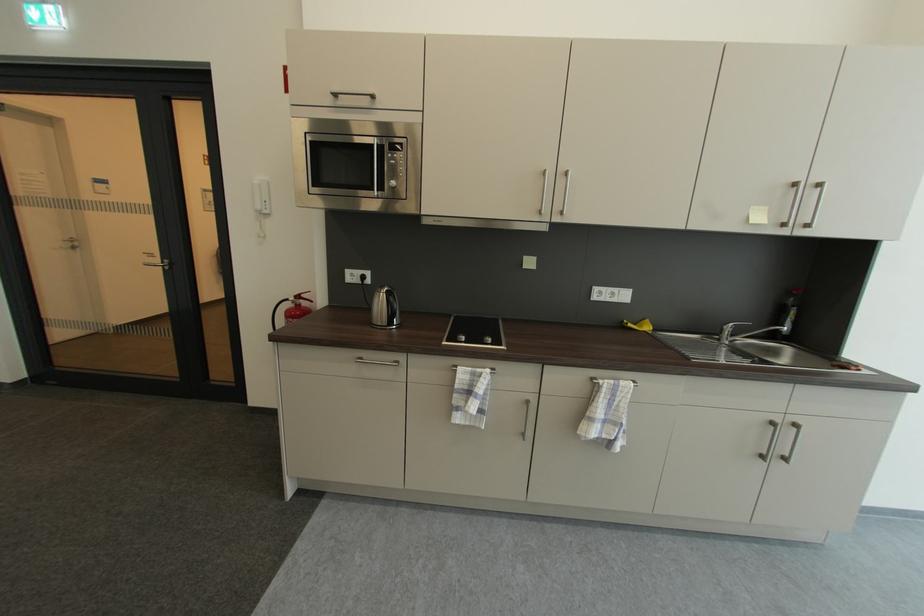
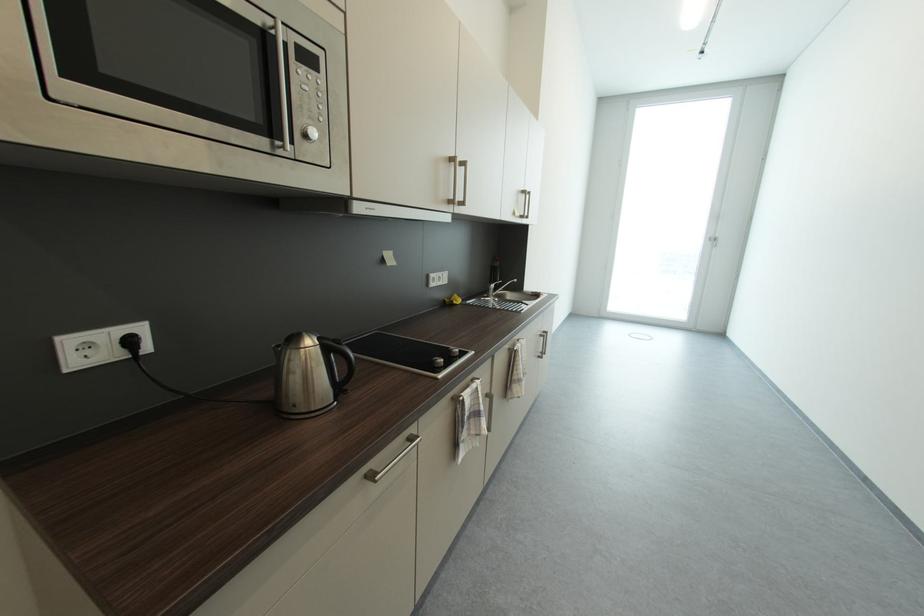
The point at (629, 323) is marked in the first image. Where is the corresponding point in the second image?

(453, 302)